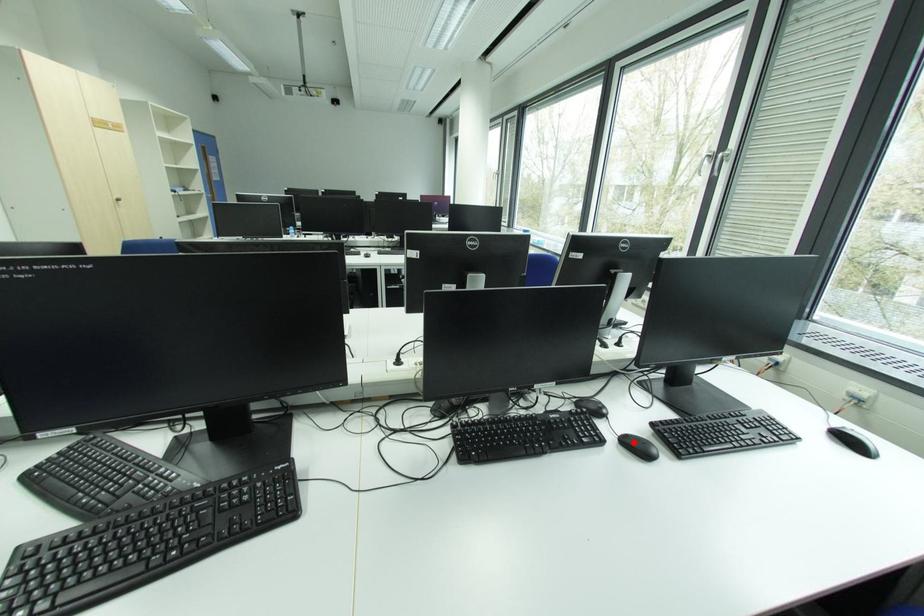
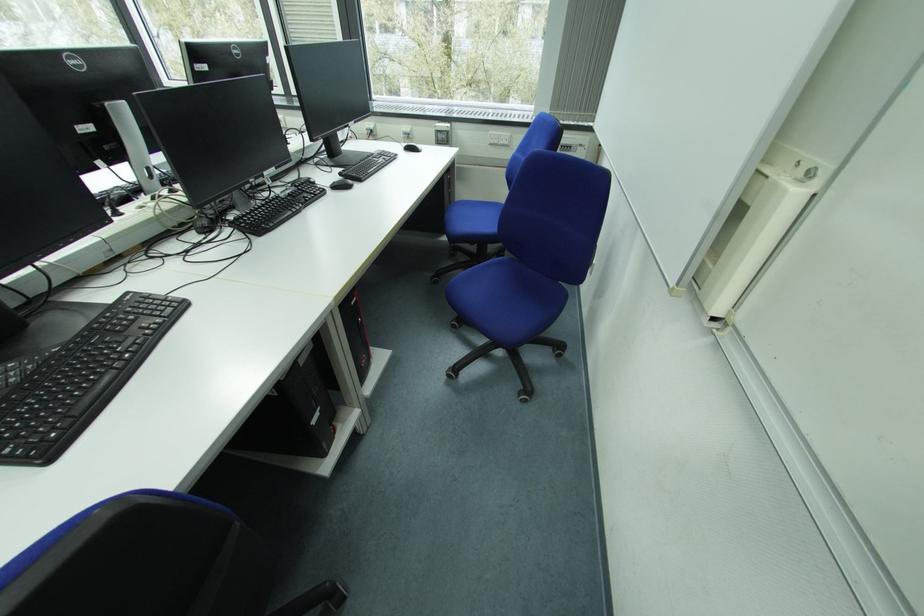
The point at the highlighted location is marked in the first image. Where is the corresponding point in the second image?

(342, 185)